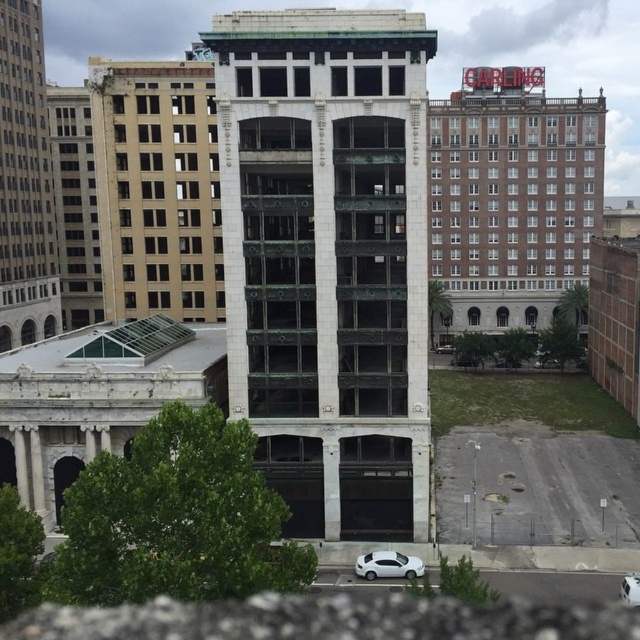
Question: Which is farther from the beige stone tower at left?

Choices:
 (A) white glossy sedan at lower center
 (B) white matte car at lower center
 (C) green marble tower at center

Answer: (B)

Question: From the image, what is the correct spatial relationship of green marble tower at center in relation to beige stone tower at left?

Choices:
 (A) below
 (B) above

Answer: (A)

Question: Does beige stone tower at left have a larger size compared to white matte car at lower center?

Choices:
 (A) yes
 (B) no

Answer: (A)

Question: Which of the following is the closest to the observer?

Choices:
 (A) (241, 173)
 (B) (632, 586)
 (C) (56, 308)
 (D) (368, 557)

Answer: (B)

Question: Where is green marble tower at center located in relation to beige stone tower at left in the image?

Choices:
 (A) right
 (B) left

Answer: (A)

Question: Which point is closer to the camera?

Choices:
 (A) beige stone tower at left
 (B) white glossy sedan at lower center

Answer: (B)